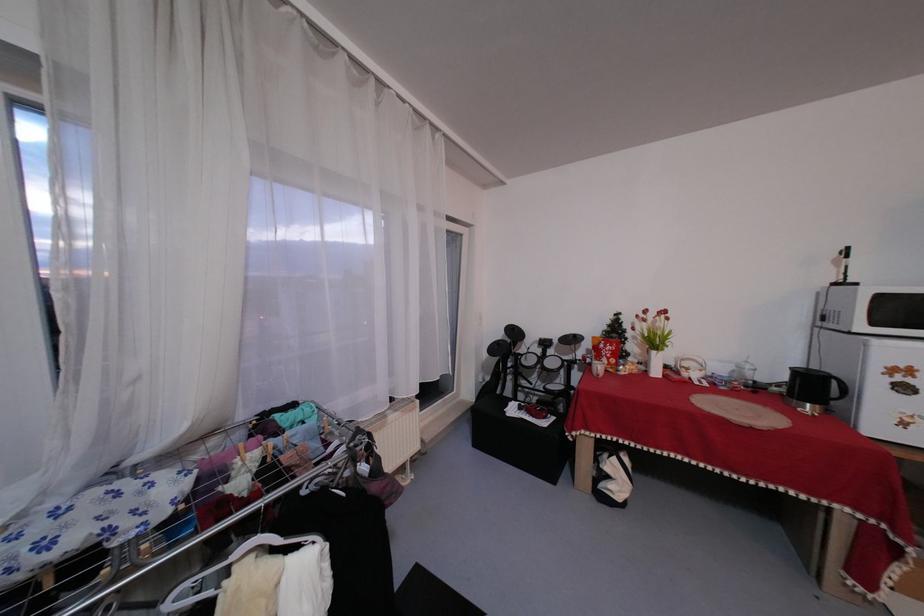
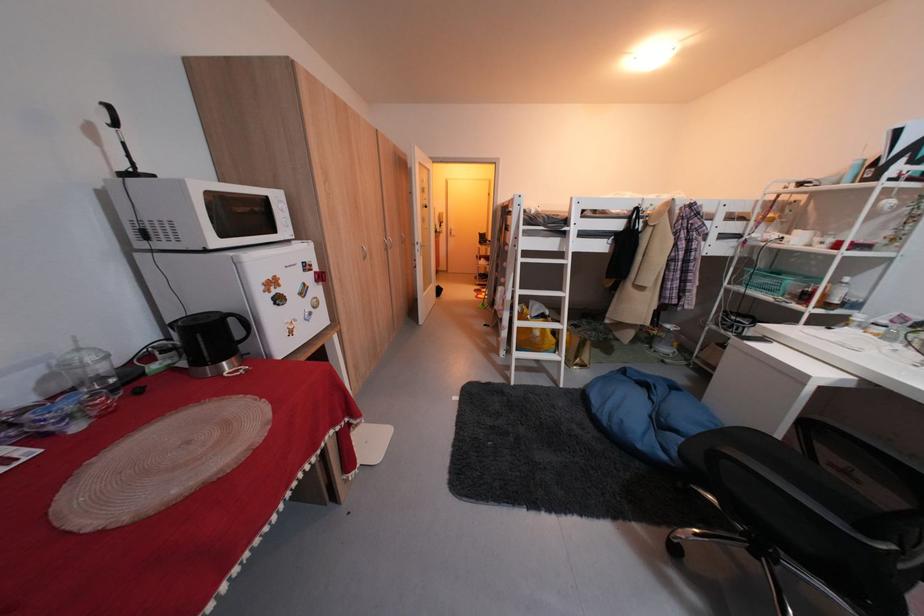
Locate, in the second image, the point that corresponds to [845,383] in the first image.

(244, 322)